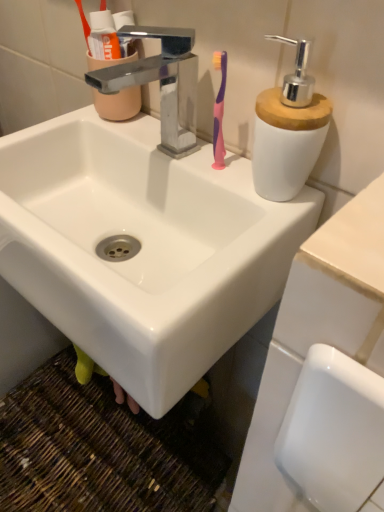
Question: Should I look upward or downward to see translucent plastic cup at upper left?

Choices:
 (A) down
 (B) up

Answer: (B)

Question: Is the surface of satin nickel faucet at center in direct contact with white ceramic sink at center?

Choices:
 (A) no
 (B) yes

Answer: (A)

Question: Is satin nickel faucet at center positioned before white ceramic sink at center?

Choices:
 (A) no
 (B) yes

Answer: (A)

Question: From the image's perspective, is satin nickel faucet at center under white ceramic sink at center?

Choices:
 (A) yes
 (B) no

Answer: (B)

Question: Considering the relative sizes of satin nickel faucet at center and white ceramic sink at center in the image provided, is satin nickel faucet at center smaller than white ceramic sink at center?

Choices:
 (A) yes
 (B) no

Answer: (A)

Question: Can you confirm if satin nickel faucet at center is thinner than white ceramic sink at center?

Choices:
 (A) yes
 (B) no

Answer: (A)

Question: From the image's perspective, is satin nickel faucet at center located above white ceramic sink at center?

Choices:
 (A) yes
 (B) no

Answer: (A)

Question: From the image's perspective, is white ceramic sink at center above translucent plastic cup at upper left?

Choices:
 (A) yes
 (B) no

Answer: (B)

Question: Does white ceramic sink at center have a larger size compared to translucent plastic cup at upper left?

Choices:
 (A) no
 (B) yes

Answer: (B)

Question: Is white ceramic sink at center not within translucent plastic cup at upper left?

Choices:
 (A) yes
 (B) no

Answer: (A)

Question: Is white ceramic sink at center not close to translucent plastic cup at upper left?

Choices:
 (A) no
 (B) yes

Answer: (A)

Question: Considering the relative positions of white ceramic sink at center and translucent plastic cup at upper left in the image provided, is white ceramic sink at center to the left of translucent plastic cup at upper left from the viewer's perspective?

Choices:
 (A) no
 (B) yes

Answer: (A)

Question: Considering the relative sizes of white ceramic sink at center and translucent plastic cup at upper left in the image provided, is white ceramic sink at center taller than translucent plastic cup at upper left?

Choices:
 (A) no
 (B) yes

Answer: (B)

Question: Is translucent plastic cup at upper left thinner than satin nickel faucet at center?

Choices:
 (A) no
 (B) yes

Answer: (B)